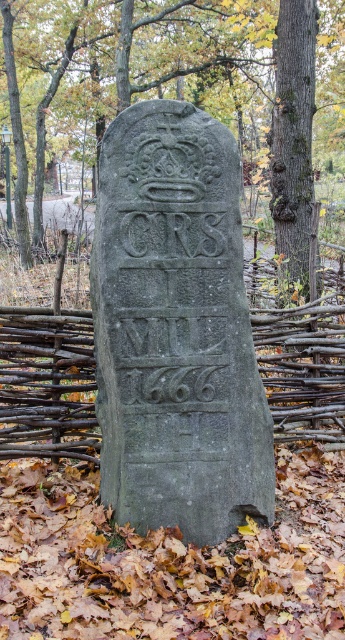
Can you confirm if green mossy tree at center is positioned above green mossy bark tree at center right?

Yes, green mossy tree at center is above green mossy bark tree at center right.

In the scene shown: Between green mossy tree at center and green mossy bark tree at center right, which one has less height?

Standing shorter between the two is green mossy tree at center.

Between point (18, 52) and point (301, 134), which one is positioned in front?

Positioned in front is point (301, 134).

Image resolution: width=345 pixels, height=640 pixels. Identify the location of green mossy tree at center. (127, 81).

Who is more forward, (290, 342) or (309, 32)?

Point (290, 342) is in front.

Is point (307, 376) positioned in front of point (293, 150)?

Yes.

Between point (64, 333) and point (294, 12), which one is positioned behind?

The point (294, 12) is more distant.

I want to click on brown wooden fence at center, so click(x=46, y=384).

Who is positioned more to the right, green mossy tree at center or brown wooden fence at center?

green mossy tree at center

Between point (209, 88) and point (276, 326), which one is positioned behind?

Point (209, 88)

Image resolution: width=345 pixels, height=640 pixels. In order to click on green mossy tree at center in this screenshot , I will do `click(127, 81)`.

The height and width of the screenshot is (640, 345). I want to click on green mossy tree at center, so click(127, 81).